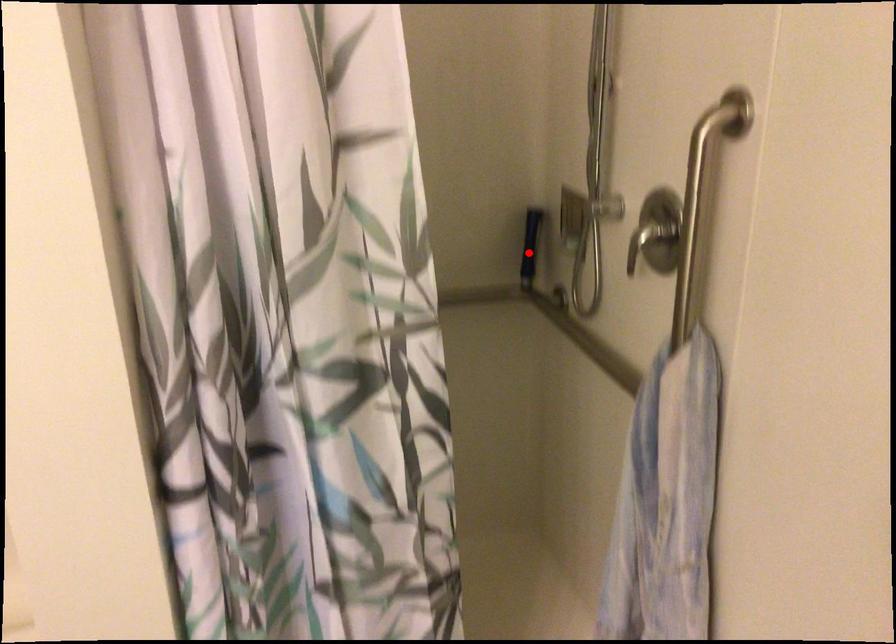
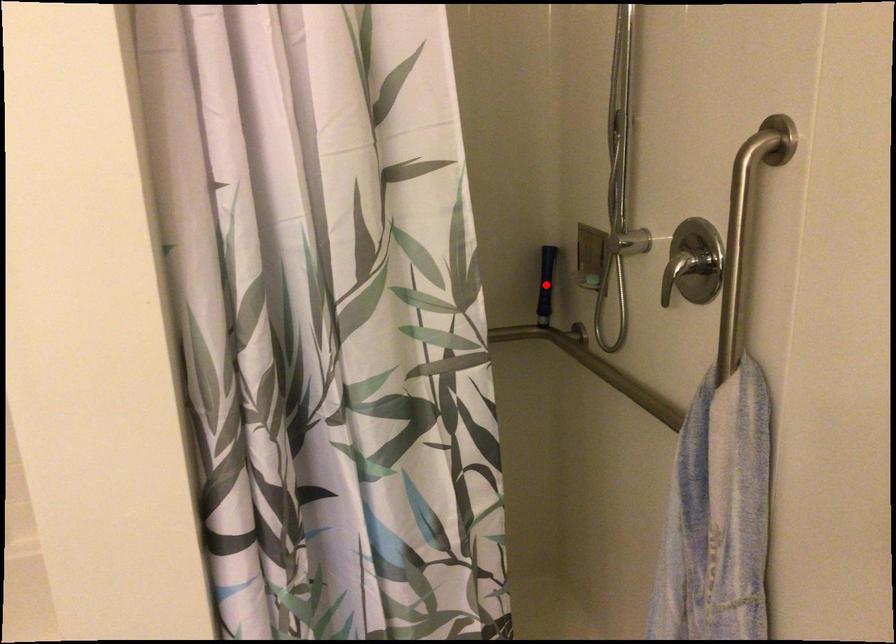
I am providing you with two images of the same scene from different viewpoints. A red point is marked on the first image and another point is marked on the second image. Is the marked point in image1 the same physical position as the marked point in image2?

Yes